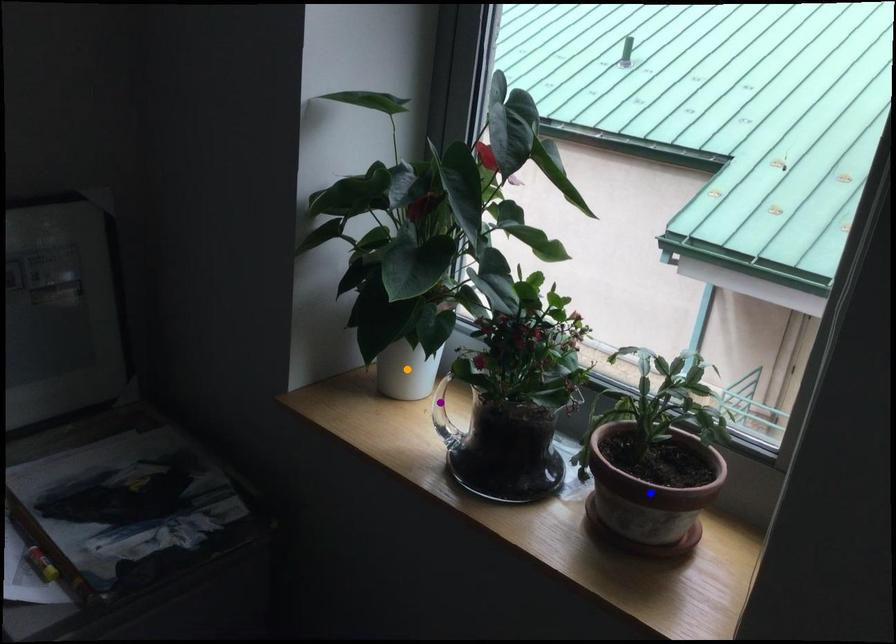
Order these from nearest to farthest:
purple point, orange point, blue point

blue point
orange point
purple point